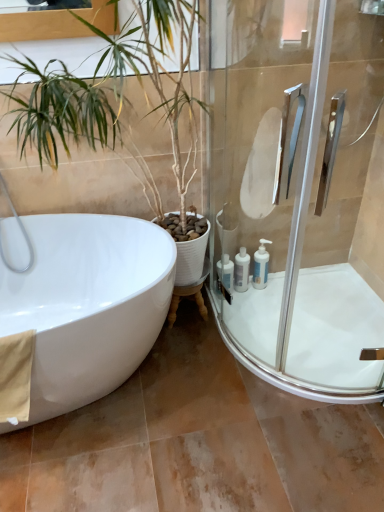
Identify the location of free point to the left of white glossy bath at lower right. (161, 406).